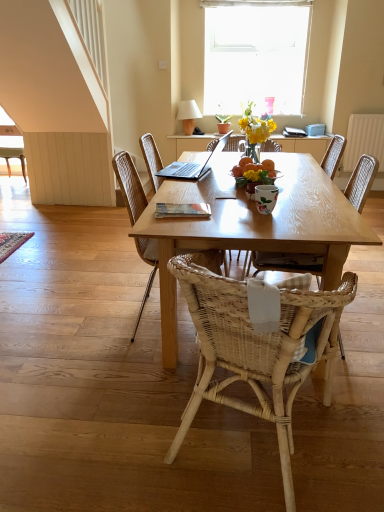
You are a GUI agent. You are given a task and a screenshot of the screen. Output one action in this format:
    pyautogui.click(x=<x>, y=<y>)
    Task: Click on the free space in front of woven wood chair at center, the 3th chair in the front-to-back sequence
    
    Given the screenshot: What is the action you would take?
    pyautogui.click(x=126, y=380)